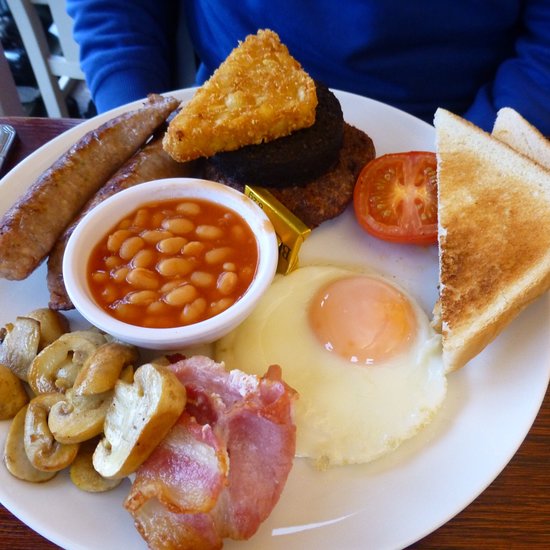
In order to click on bowl in this screenshot , I will do `click(258, 280)`.